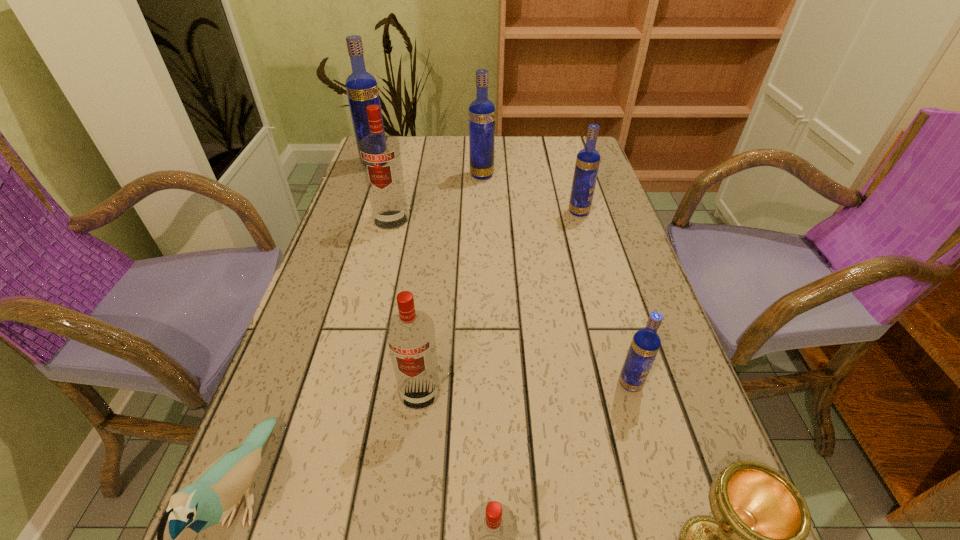
Identify the location of vacant space that's between the nearest blue vodka and the biggest red vodka. This screenshot has width=960, height=540. tap(511, 302).

Identify the location of free space between the smallest blue vodka and the second red vodka from right to left. (525, 388).

The height and width of the screenshot is (540, 960). In order to click on vacant space that is in between the tallest object and the third farthest blue vodka in this screenshot , I will do `click(477, 187)`.

Locate an element on the screen. The height and width of the screenshot is (540, 960). free space between the second nearest red vodka and the third farthest blue vodka is located at coordinates (499, 302).

What are the coordinates of `vacant space that's between the second biggest red vodka and the smallest blue vodka` in the screenshot? It's located at (525, 388).

Find the location of a particular element. The height and width of the screenshot is (540, 960). free space between the second nearest blue vodka and the fourth object from left to right is located at coordinates (499, 302).

In order to click on the seventh closest object to the second smallest red vodka in this screenshot , I will do `click(481, 111)`.

Identify the location of object that stands as the seventh closest to the bird. (481, 111).

This screenshot has height=540, width=960. I want to click on vodka that stands as the fourth closest to the third biggest blue vodka, so click(x=362, y=90).

Where is `vodka that is the sixth closest one to the chalice`? The image size is (960, 540). vodka that is the sixth closest one to the chalice is located at coordinates (481, 111).